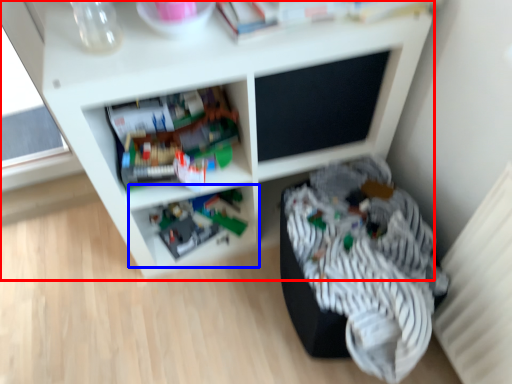
Question: Which of the following is the farthest to the observer, shelf (highlighted by a red box) or shelf (highlighted by a blue box)?

Choices:
 (A) shelf
 (B) shelf

Answer: (B)